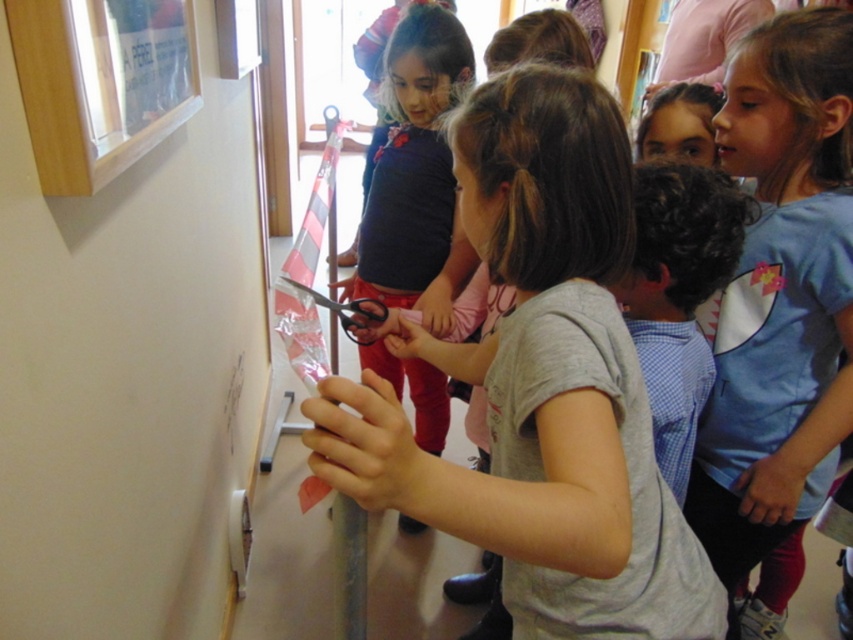
You are a photographer setting up for a group photo. You need to ensure that the matte black shirt at center and the wooden frame at upper left are both visible in the shot. Given their sizes, which object might require you to adjust your camera angle to include it properly?

The matte black shirt at center has a larger size compared to wooden frame at upper left, so you might need to adjust the camera angle to ensure the larger matte black shirt at center is fully captured in the frame.

In the scene shown: You are a photographer trying to capture the scene. You want to ensure the blue cotton shirt at center and the wooden frame at upper left are both visible in the photo. Based on their positions, which object should be placed closer to the right side of the photo frame?

The blue cotton shirt at center should be placed closer to the right side of the photo frame because it is positioned to the right of the wooden frame at upper left in the scene.

You are a photographer trying to capture a photo of the blue cotton shirt at center and the wooden frame at upper left in the scene. If you want to ensure both objects are fully visible in the frame without cropping, which object requires more space horizontally?

The blue cotton shirt at center might require more space horizontally since it might be wider than the wooden frame at upper left.